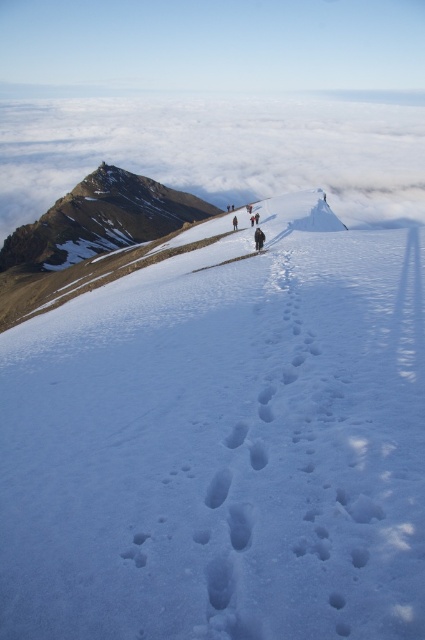
Who is positioned more to the left, white snow at center or snowy rocky peak at upper left?

From the viewer's perspective, snowy rocky peak at upper left appears more on the left side.

Between point (231, 464) and point (88, 218), which one is positioned in front?

Point (231, 464) is more forward.

Which is behind, point (294, 195) or point (13, 250)?

Point (13, 250)

You are a GUI agent. You are given a task and a screenshot of the screen. Output one action in this format:
    pyautogui.click(x=<x>, y=<y>)
    Task: Click on the white snow at center
    This screenshot has height=640, width=425.
    Given the screenshot: What is the action you would take?
    pyautogui.click(x=223, y=444)

You are a GUI agent. You are given a task and a screenshot of the screen. Output one action in this format:
    pyautogui.click(x=<x>, y=<y>)
    Task: Click on the white snow at center
    This screenshot has width=425, height=640.
    Given the screenshot: What is the action you would take?
    pyautogui.click(x=223, y=444)

Image resolution: width=425 pixels, height=640 pixels. Find the location of `white snow at center`. white snow at center is located at coordinates (223, 444).

Is snowy rocky peak at upper left wider than dark brown fur coat at center?

Indeed, snowy rocky peak at upper left has a greater width compared to dark brown fur coat at center.

The image size is (425, 640). Describe the element at coordinates (101, 220) in the screenshot. I see `snowy rocky peak at upper left` at that location.

The width and height of the screenshot is (425, 640). In order to click on snowy rocky peak at upper left in this screenshot , I will do `click(101, 220)`.